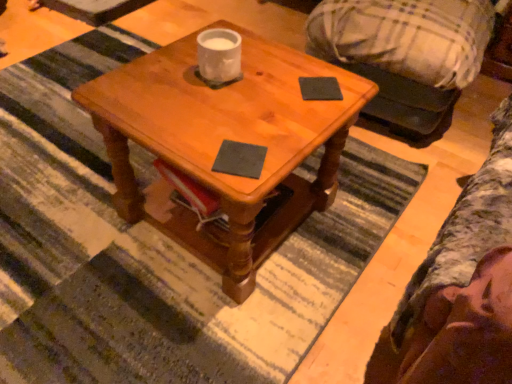
Locate an element on the screen. This screenshot has width=512, height=384. dark gray matte notepad at center, which is counted as the second notepad, starting from the back is located at coordinates (240, 159).

The width and height of the screenshot is (512, 384). I want to click on wooden coffee table at center, so click(x=226, y=138).

Measure the distance between black matte notepad at upper right, positioned as the first notepad in top-to-bottom order, and camera.

A distance of 3.54 feet exists between black matte notepad at upper right, positioned as the first notepad in top-to-bottom order, and camera.

Image resolution: width=512 pixels, height=384 pixels. In order to click on dark gray matte notepad at center, which is counted as the second notepad, starting from the back in this screenshot , I will do `click(240, 159)`.

Which object is further away from the camera taking this photo, wooden coffee table at center or dark gray matte notepad at center, the first notepad positioned from the left?

Positioned behind is dark gray matte notepad at center, the first notepad positioned from the left.

Which of these two, wooden coffee table at center or dark gray matte notepad at center, acting as the second notepad starting from the right, stands shorter?

dark gray matte notepad at center, acting as the second notepad starting from the right.

Consider the image. Does wooden coffee table at center have a smaller size compared to dark gray matte notepad at center, which is the 1th notepad from bottom to top?

No, wooden coffee table at center is not smaller than dark gray matte notepad at center, which is the 1th notepad from bottom to top.

Is wooden coffee table at center positioned in front of black matte notepad at upper right, placed as the 2th notepad when sorted from left to right?

Yes, it is.

From the image's perspective, which one is positioned lower, wooden coffee table at center or black matte notepad at upper right, placed as the second notepad when sorted from bottom to top?

wooden coffee table at center appears lower in the image.

In the image, is wooden coffee table at center on the left side or the right side of black matte notepad at upper right, the 1th notepad viewed from the back?

wooden coffee table at center is positioned on black matte notepad at upper right, the 1th notepad viewed from the back,'s left side.

Is wooden coffee table at center far away from black matte notepad at upper right, placed as the 2th notepad when sorted from left to right?

Actually, wooden coffee table at center and black matte notepad at upper right, placed as the 2th notepad when sorted from left to right, are a little close together.

Is point (325, 99) closer to camera compared to point (256, 165)?

No.

Is black matte notepad at upper right, which appears as the first notepad when viewed from the right, wider or thinner than dark gray matte notepad at center, which is the second notepad from top to bottom?

Clearly, black matte notepad at upper right, which appears as the first notepad when viewed from the right, has more width compared to dark gray matte notepad at center, which is the second notepad from top to bottom.

In the image, is black matte notepad at upper right, positioned as the first notepad in top-to-bottom order, positioned in front of or behind dark gray matte notepad at center, which is the second notepad from top to bottom?

In the image, black matte notepad at upper right, positioned as the first notepad in top-to-bottom order, appears behind dark gray matte notepad at center, which is the second notepad from top to bottom.

Between black matte notepad at upper right, placed as the 2th notepad when sorted from left to right, and dark gray matte notepad at center, acting as the second notepad starting from the right, which one has less height?

With less height is dark gray matte notepad at center, acting as the second notepad starting from the right.

From a real-world perspective, between black matte notepad at upper right, positioned as the first notepad in top-to-bottom order, and wooden coffee table at center, who is vertically higher?

black matte notepad at upper right, positioned as the first notepad in top-to-bottom order, is physically above.

Is black matte notepad at upper right, the 1th notepad viewed from the back, inside the boundaries of wooden coffee table at center, or outside?

black matte notepad at upper right, the 1th notepad viewed from the back, fits inside wooden coffee table at center.

Considering the sizes of black matte notepad at upper right, positioned as the first notepad in top-to-bottom order, and wooden coffee table at center in the image, is black matte notepad at upper right, positioned as the first notepad in top-to-bottom order, taller or shorter than wooden coffee table at center?

Clearly, black matte notepad at upper right, positioned as the first notepad in top-to-bottom order, is shorter compared to wooden coffee table at center.

Considering the relative sizes of dark gray matte notepad at center, acting as the second notepad starting from the right, and black matte notepad at upper right, the second notepad viewed from the front, in the image provided, is dark gray matte notepad at center, acting as the second notepad starting from the right, bigger than black matte notepad at upper right, the second notepad viewed from the front,?

Incorrect, dark gray matte notepad at center, acting as the second notepad starting from the right, is not larger than black matte notepad at upper right, the second notepad viewed from the front.

Does dark gray matte notepad at center, which is the 1th notepad from bottom to top, contain black matte notepad at upper right, placed as the 2th notepad when sorted from left to right?

No, black matte notepad at upper right, placed as the 2th notepad when sorted from left to right, is located outside of dark gray matte notepad at center, which is the 1th notepad from bottom to top.

From a real-world perspective, which is physically below, dark gray matte notepad at center, acting as the second notepad starting from the right, or black matte notepad at upper right, placed as the second notepad when sorted from bottom to top?

dark gray matte notepad at center, acting as the second notepad starting from the right, from a real-world perspective.

Is dark gray matte notepad at center, which is the 1th notepad from bottom to top, situated inside wooden coffee table at center or outside?

dark gray matte notepad at center, which is the 1th notepad from bottom to top, lies within the bounds of wooden coffee table at center.

Measure the distance between dark gray matte notepad at center, which is the second notepad from top to bottom, and wooden coffee table at center.

dark gray matte notepad at center, which is the second notepad from top to bottom, and wooden coffee table at center are 11.62 inches apart.

In terms of height, does dark gray matte notepad at center, the 1th notepad in the front-to-back sequence, look taller or shorter compared to wooden coffee table at center?

In the image, dark gray matte notepad at center, the 1th notepad in the front-to-back sequence, appears to be shorter than wooden coffee table at center.

Where is `coffee table that appears above the dark gray matte notepad at center, acting as the second notepad starting from the right (from the image's perspective)`? The height and width of the screenshot is (384, 512). coffee table that appears above the dark gray matte notepad at center, acting as the second notepad starting from the right (from the image's perspective) is located at coordinates (226, 138).

Identify the location of notepad that is the 2nd object located behind the wooden coffee table at center. The width and height of the screenshot is (512, 384). (320, 89).

When comparing their distances from wooden coffee table at center, does black matte notepad at upper right, the second notepad viewed from the front, or dark gray matte notepad at center, which is the second notepad from top to bottom, seem closer?

Based on the image, dark gray matte notepad at center, which is the second notepad from top to bottom, appears to be nearer to wooden coffee table at center.

Estimate the real-world distances between objects in this image. Which object is further from dark gray matte notepad at center, which is the second notepad from top to bottom, wooden coffee table at center or black matte notepad at upper right, the 1th notepad viewed from the back?

The object further to dark gray matte notepad at center, which is the second notepad from top to bottom, is wooden coffee table at center.

Looking at the image, which one is located closer to wooden coffee table at center, dark gray matte notepad at center, the first notepad positioned from the left, or black matte notepad at upper right, the second notepad viewed from the front?

The object closer to wooden coffee table at center is dark gray matte notepad at center, the first notepad positioned from the left.

Looking at the image, which one is located further to black matte notepad at upper right, placed as the 2th notepad when sorted from left to right, wooden coffee table at center or dark gray matte notepad at center, which is the 1th notepad from bottom to top?

Based on the image, wooden coffee table at center appears to be further to black matte notepad at upper right, placed as the 2th notepad when sorted from left to right.

Which object lies further to the anchor point dark gray matte notepad at center, the first notepad positioned from the left, black matte notepad at upper right, the second notepad viewed from the front, or wooden coffee table at center?

The object further to dark gray matte notepad at center, the first notepad positioned from the left, is wooden coffee table at center.

From the image, which object appears to be nearer to black matte notepad at upper right, placed as the second notepad when sorted from bottom to top, dark gray matte notepad at center, which is the second notepad from top to bottom, or wooden coffee table at center?

The object closer to black matte notepad at upper right, placed as the second notepad when sorted from bottom to top, is dark gray matte notepad at center, which is the second notepad from top to bottom.

Identify the location of notepad located between wooden coffee table at center and black matte notepad at upper right, positioned as the first notepad in top-to-bottom order, in the depth direction. (240, 159).